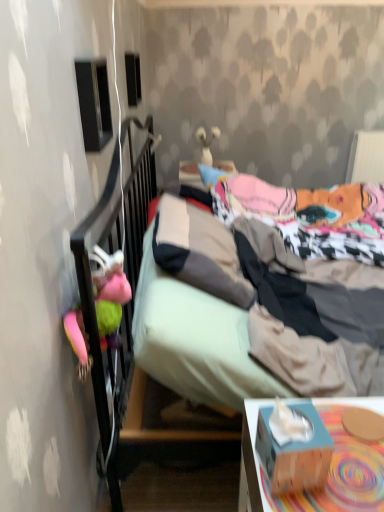
What do you see at coordinates (207, 144) in the screenshot? I see `white glossy vase at upper center, which is counted as the first toy, starting from the top` at bounding box center [207, 144].

In order to face textured fabric bed at center, should I rotate leftwards or rightwards?

You should look right and rotate roughly 15.644 degrees.

The height and width of the screenshot is (512, 384). I want to click on black matte speaker at upper left, arranged as the 2th loudspeaker when viewed from the top, so click(94, 103).

Measure the distance between point (x=289, y=494) and camera.

The depth of point (x=289, y=494) is 32.83 inches.

You are a GUI agent. You are given a task and a screenshot of the screen. Output one action in this format:
    pyautogui.click(x=<x>, y=<y>)
    Task: Click on the black plastic speaker at upper center, acting as the first loudspeaker starting from the top
    The width and height of the screenshot is (384, 512).
    Given the screenshot: What is the action you would take?
    coord(133,79)

Does multicolored plush toy at left, positioned as the first toy in bottom-to-top order, have a larger size compared to black matte speaker at upper left, which is counted as the first loudspeaker, starting from the bottom?

Yes.

Is multicolored plush toy at left, the 1th toy from the left, taller or shorter than black matte speaker at upper left, which is counted as the first loudspeaker, starting from the bottom?

Clearly, multicolored plush toy at left, the 1th toy from the left, is shorter compared to black matte speaker at upper left, which is counted as the first loudspeaker, starting from the bottom.

From the picture: Does wooden tissue box at lower right contain blue cardboard tissue box at lower right?

No, blue cardboard tissue box at lower right is not surrounded by wooden tissue box at lower right.

In the scene shown: Does wooden tissue box at lower right come in front of blue cardboard tissue box at lower right?

No, it is not.

Based on the photo, from the image's perspective, does wooden tissue box at lower right appear lower than blue cardboard tissue box at lower right?

Correct, wooden tissue box at lower right appears lower than blue cardboard tissue box at lower right in the image.

Considering the sizes of objects white glossy vase at upper center, the second toy when ordered from bottom to top, and wooden tissue box at lower right in the image provided, who is thinner, white glossy vase at upper center, the second toy when ordered from bottom to top, or wooden tissue box at lower right?

With smaller width is white glossy vase at upper center, the second toy when ordered from bottom to top.

How many degrees apart are the facing directions of white glossy vase at upper center, acting as the first toy starting from the right, and wooden tissue box at lower right?

1.02 degrees.

Consider the image. From the image's perspective, who appears lower, white glossy vase at upper center, which is counted as the first toy, starting from the top, or wooden tissue box at lower right?

wooden tissue box at lower right.

Is white glossy vase at upper center, the second toy when ordered from bottom to top, aimed at wooden tissue box at lower right?

No, white glossy vase at upper center, the second toy when ordered from bottom to top, is not aimed at wooden tissue box at lower right.

Who is bigger, blue cardboard tissue box at lower right or wooden tissue box at lower right?

Bigger between the two is wooden tissue box at lower right.

Are blue cardboard tissue box at lower right and wooden tissue box at lower right beside each other?

Yes.

Considering the positions of objects blue cardboard tissue box at lower right and wooden tissue box at lower right in the image provided, who is in front, blue cardboard tissue box at lower right or wooden tissue box at lower right?

blue cardboard tissue box at lower right.

Is blue cardboard tissue box at lower right positioned with its back to black plastic speaker at upper center, which is the 2th loudspeaker from front to back?

No.

Is blue cardboard tissue box at lower right positioned before black plastic speaker at upper center, positioned as the first loudspeaker in back-to-front order?

Yes, the depth of blue cardboard tissue box at lower right is less than that of black plastic speaker at upper center, positioned as the first loudspeaker in back-to-front order.

From a real-world perspective, is blue cardboard tissue box at lower right under black plastic speaker at upper center, positioned as the first loudspeaker in back-to-front order?

Yes, from a real-world perspective, blue cardboard tissue box at lower right is under black plastic speaker at upper center, positioned as the first loudspeaker in back-to-front order.

Does point (218, 133) lie in front of point (105, 115)?

That is False.

Locate an element on the screen. toy located above the black matte speaker at upper left, arranged as the 2th loudspeaker when viewed from the top (from the image's perspective) is located at coordinates (207, 144).

From a real-world perspective, which is physically above, white glossy vase at upper center, the first toy positioned from the back, or black matte speaker at upper left, which is counted as the first loudspeaker, starting from the bottom?

black matte speaker at upper left, which is counted as the first loudspeaker, starting from the bottom, is physically above.

What's the angular difference between white glossy vase at upper center, the second toy when ordered from bottom to top, and black matte speaker at upper left, positioned as the 2th loudspeaker in back-to-front order,'s facing directions?

There is a 0.964-degree angle between the facing directions of white glossy vase at upper center, the second toy when ordered from bottom to top, and black matte speaker at upper left, positioned as the 2th loudspeaker in back-to-front order.

From a real-world perspective, does wooden tissue box at lower right sit lower than white glossy vase at upper center, acting as the first toy starting from the right?

Indeed, from a real-world perspective, wooden tissue box at lower right is positioned beneath white glossy vase at upper center, acting as the first toy starting from the right.

Is wooden tissue box at lower right outside of white glossy vase at upper center, the first toy positioned from the back?

wooden tissue box at lower right is positioned outside white glossy vase at upper center, the first toy positioned from the back.

Considering the positions of objects wooden tissue box at lower right and white glossy vase at upper center, which is counted as the first toy, starting from the top, in the image provided, who is more to the right, wooden tissue box at lower right or white glossy vase at upper center, which is counted as the first toy, starting from the top,?

wooden tissue box at lower right is more to the right.

Between wooden tissue box at lower right and white glossy vase at upper center, arranged as the second toy when viewed from the front, which one has smaller size?

With smaller size is white glossy vase at upper center, arranged as the second toy when viewed from the front.

Find the location of a particular element. the 1st loudspeaker positioned above the multicolored plush toy at left, the second toy from the top (from a real-world perspective) is located at coordinates (94, 103).

In the image, there is a wooden tissue box at lower right. What are the coordinates of `box above it (from the image's perspective)` in the screenshot? It's located at (294, 452).

From the image, which object appears to be nearer to multicolored plush toy at left, the 2th toy when ordered from back to front, black matte speaker at upper left, which is counted as the first loudspeaker, starting from the bottom, or black plastic speaker at upper center, positioned as the first loudspeaker in back-to-front order?

Based on the image, black matte speaker at upper left, which is counted as the first loudspeaker, starting from the bottom, appears to be nearer to multicolored plush toy at left, the 2th toy when ordered from back to front.

From the image, which object appears to be nearer to textured fabric bed at center, wooden tissue box at lower right or white glossy vase at upper center, arranged as the second toy when viewed from the front?

wooden tissue box at lower right lies closer to textured fabric bed at center than the other object.

When comparing their distances from textured fabric bed at center, does blue cardboard tissue box at lower right or multicolored plush toy at left, the second toy from the top, seem closer?

multicolored plush toy at left, the second toy from the top, is closer to textured fabric bed at center.

Consider the image. When comparing their distances from white glossy vase at upper center, which is the 2th toy from left to right, does textured fabric bed at center or black matte speaker at upper left, arranged as the 2th loudspeaker when viewed from the top, seem further?

Based on the image, black matte speaker at upper left, arranged as the 2th loudspeaker when viewed from the top, appears to be further to white glossy vase at upper center, which is the 2th toy from left to right.

Considering their positions, is black matte speaker at upper left, marked as the first loudspeaker in a front-to-back arrangement, positioned closer to black plastic speaker at upper center, which is the 2th loudspeaker from front to back, than multicolored plush toy at left, positioned as the 2th toy in right-to-left order?

Among the two, black matte speaker at upper left, marked as the first loudspeaker in a front-to-back arrangement, is located nearer to black plastic speaker at upper center, which is the 2th loudspeaker from front to back.

Considering their positions, is multicolored plush toy at left, the 2th toy when ordered from back to front, positioned further to blue cardboard tissue box at lower right than white glossy vase at upper center, which is counted as the first toy, starting from the top?

white glossy vase at upper center, which is counted as the first toy, starting from the top.

Based on their spatial positions, is white glossy vase at upper center, arranged as the second toy when viewed from the front, or multicolored plush toy at left, the 1th toy from the left, further from blue cardboard tissue box at lower right?

white glossy vase at upper center, arranged as the second toy when viewed from the front, is further to blue cardboard tissue box at lower right.

Which object lies nearer to the anchor point blue cardboard tissue box at lower right, black plastic speaker at upper center, which is the 2th loudspeaker from front to back, or multicolored plush toy at left, the 2th toy when ordered from back to front?

multicolored plush toy at left, the 2th toy when ordered from back to front.

Find the location of a particular element. loudspeaker located between multicolored plush toy at left, the 2th toy when ordered from back to front, and black plastic speaker at upper center, which is the 2th loudspeaker from front to back, in the depth direction is located at coordinates (94, 103).

You are a GUI agent. You are given a task and a screenshot of the screen. Output one action in this format:
    pyautogui.click(x=<x>, y=<y>)
    Task: Click on the bed positioned between blue cardboard tissue box at lower right and black plastic speaker at upper center, which is the second loudspeaker in bottom-to-top order, from near to far
    
    Given the screenshot: What is the action you would take?
    pyautogui.click(x=258, y=198)

Find the location of a particular element. This screenshot has width=384, height=512. loudspeaker between black plastic speaker at upper center, which is the 2th loudspeaker from front to back, and wooden tissue box at lower right in the up-down direction is located at coordinates (94, 103).

Identify the location of box between black plastic speaker at upper center, which is the 2th loudspeaker from front to back, and wooden tissue box at lower right, in the vertical direction. This screenshot has width=384, height=512. (294, 452).